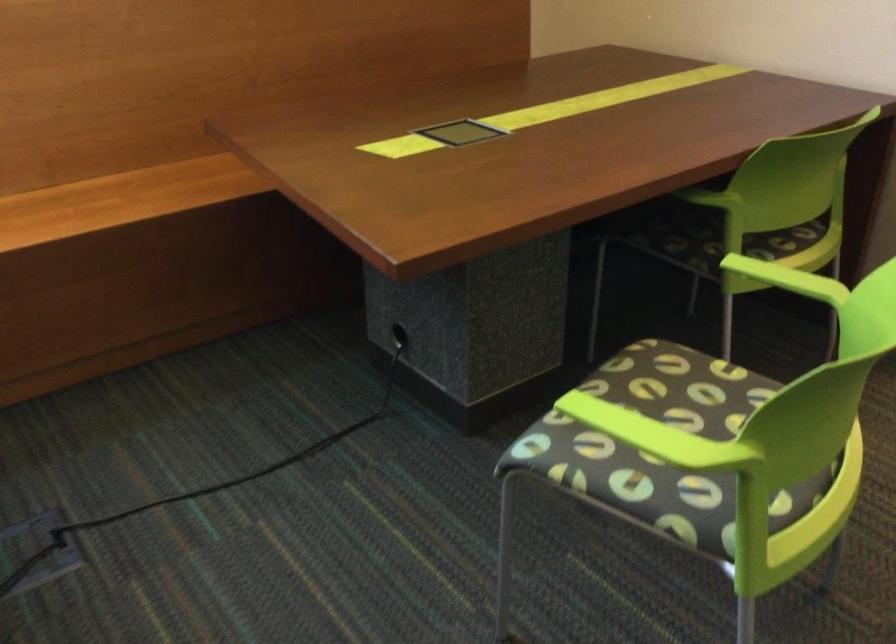
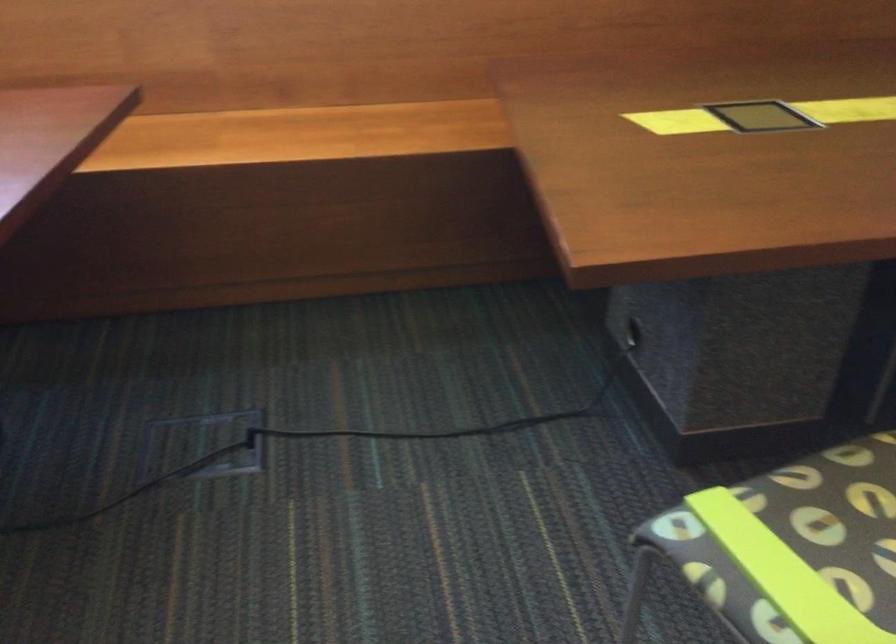
In the second image, find the point that corresponds to (658,386) in the first image.

(871, 496)